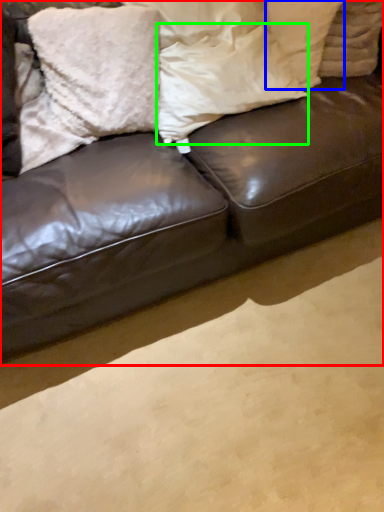
Question: Which object is the closest to the studio couch (highlighted by a red box)? Choose among these: pillow (highlighted by a blue box) or pillow (highlighted by a green box).

Choices:
 (A) pillow
 (B) pillow

Answer: (B)